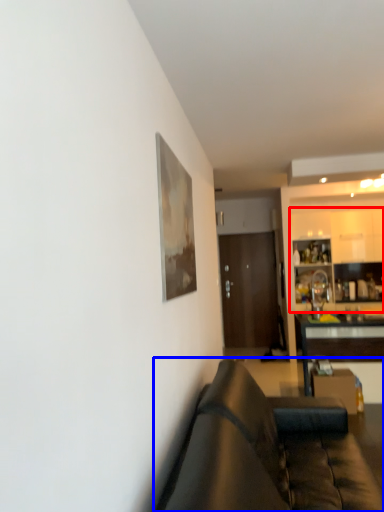
Question: Which object is closer to the camera taking this photo, cabinetry (highlighted by a red box) or studio couch (highlighted by a blue box)?

Choices:
 (A) cabinetry
 (B) studio couch

Answer: (B)